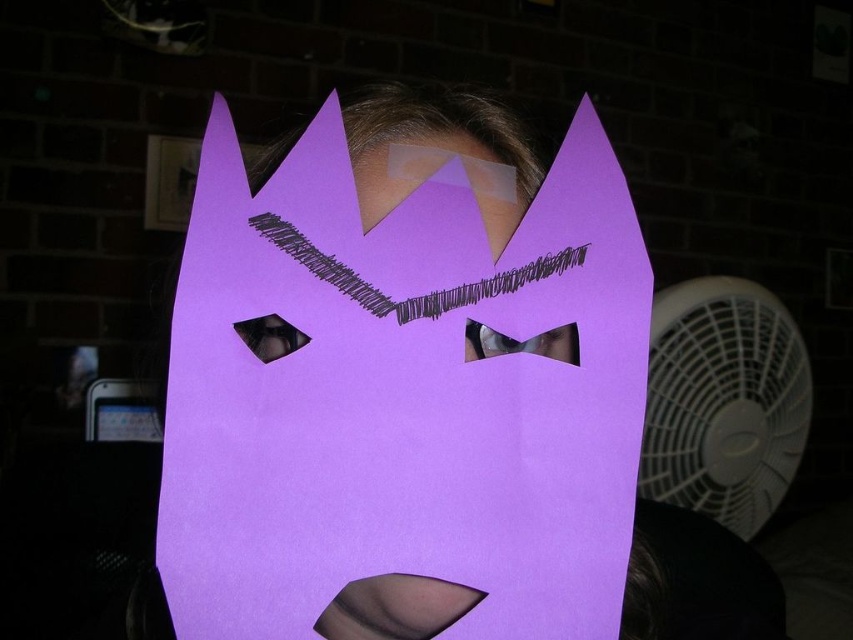
Which is above, purple paper mask at center or white plastic fan at right?

purple paper mask at center is above.

The width and height of the screenshot is (853, 640). What do you see at coordinates (402, 394) in the screenshot?
I see `purple paper mask at center` at bounding box center [402, 394].

Does point (338, 365) come behind point (682, 484)?

That is False.

Where is `purple paper mask at center`? The width and height of the screenshot is (853, 640). purple paper mask at center is located at coordinates (402, 394).